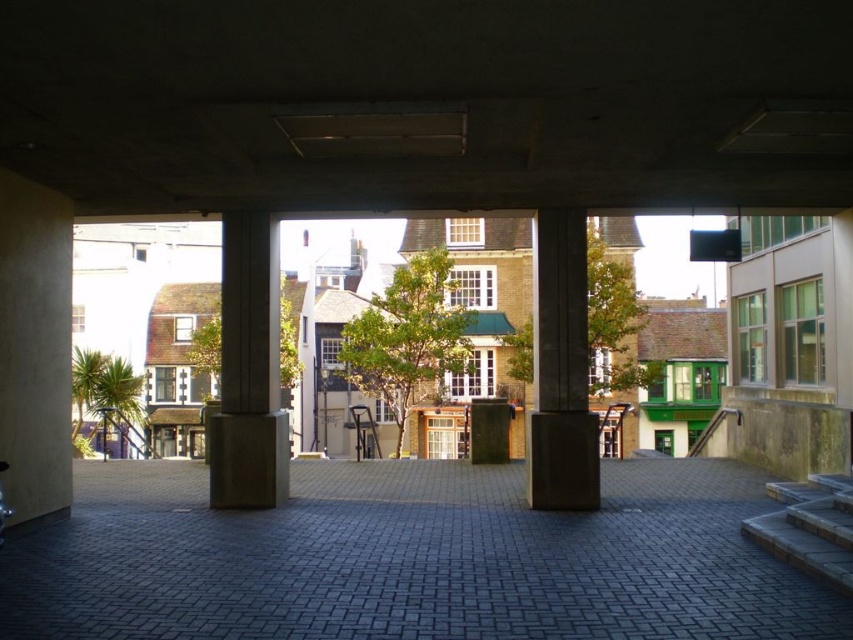
Question: Among these objects, which one is farthest from the camera?

Choices:
 (A) gray concrete alley at center
 (B) concrete column at center

Answer: (B)

Question: Among these points, which one is farthest from the camera?

Choices:
 (A) (540, 420)
 (B) (271, 392)
 (C) (706, 609)

Answer: (B)

Question: Which point appears closest to the camera in this image?

Choices:
 (A) [20, 612]
 (B) [538, 269]

Answer: (A)

Question: Is gray concrete alley at center below concrete column at center?

Choices:
 (A) yes
 (B) no

Answer: (A)

Question: Does gray concrete alley at center appear under concrete column at center?

Choices:
 (A) no
 (B) yes

Answer: (B)

Question: Can you confirm if concrete at center is positioned to the left of concrete column at center?

Choices:
 (A) yes
 (B) no

Answer: (A)